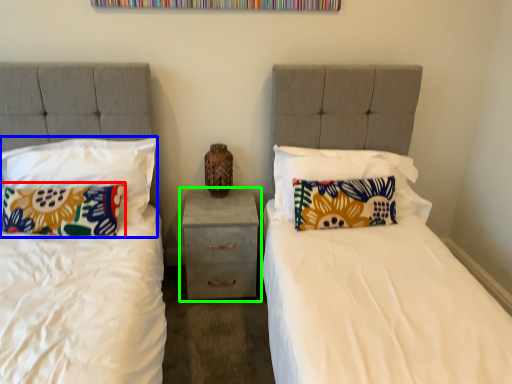
Question: Estimate the real-world distances between objects in this image. Which object is farther from pillow (highlighted by a red box), pillow (highlighted by a blue box) or nightstand (highlighted by a green box)?

Choices:
 (A) pillow
 (B) nightstand

Answer: (B)